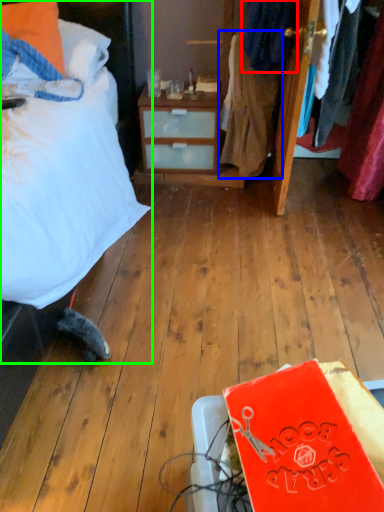
Question: Which is farther away from clothing (highlighted by a red box)? clothing (highlighted by a blue box) or bed (highlighted by a green box)?

Choices:
 (A) clothing
 (B) bed

Answer: (B)